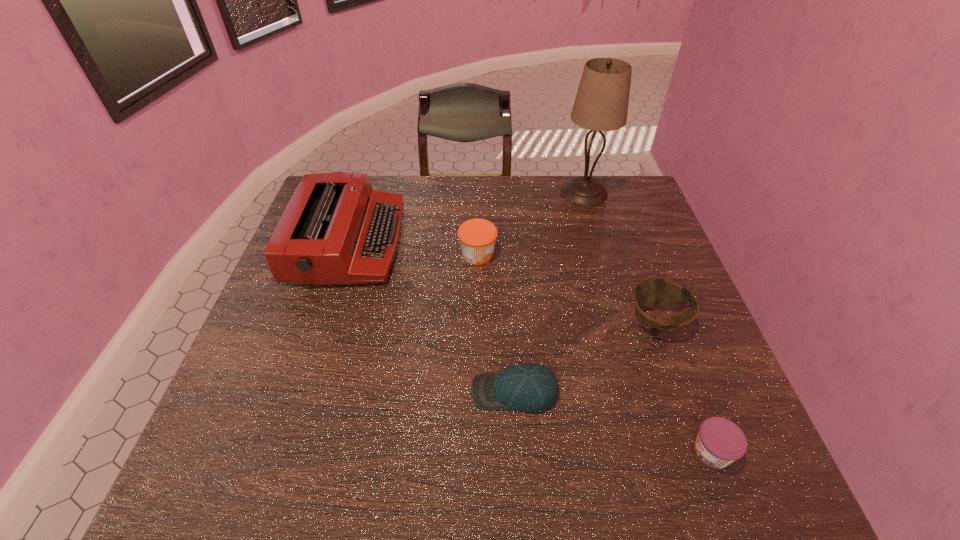
Locate an element on the screen. The height and width of the screenshot is (540, 960). free space that satisfies the following two spatial constraints: 1. on the back side of the baseball cap; 2. on the left side of the third nearest object is located at coordinates (511, 320).

In order to click on vacant region that satisfies the following two spatial constraints: 1. on the back side of the fourth farthest object; 2. on the front label of the taller jam in this screenshot , I will do `click(634, 254)`.

Find the location of a particular element. This screenshot has width=960, height=540. blank space that satisfies the following two spatial constraints: 1. on the typing side of the bowl; 2. on the right side of the leftmost object is located at coordinates (323, 320).

Where is `vacant space that satisfies the following two spatial constraints: 1. on the typing side of the second tallest object; 2. on the right side of the second nearest object`? vacant space that satisfies the following two spatial constraints: 1. on the typing side of the second tallest object; 2. on the right side of the second nearest object is located at coordinates (300, 392).

Where is `blank space that satisfies the following two spatial constraints: 1. on the front-facing side of the tallest object; 2. on the front label of the left jam`? blank space that satisfies the following two spatial constraints: 1. on the front-facing side of the tallest object; 2. on the front label of the left jam is located at coordinates (602, 254).